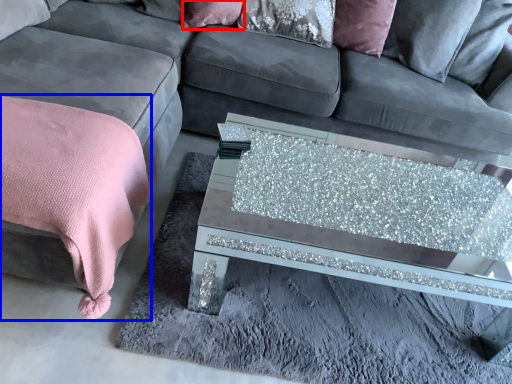
Question: Which point is further to the camera, pillow (highlighted by a red box) or blanket (highlighted by a blue box)?

Choices:
 (A) pillow
 (B) blanket

Answer: (A)